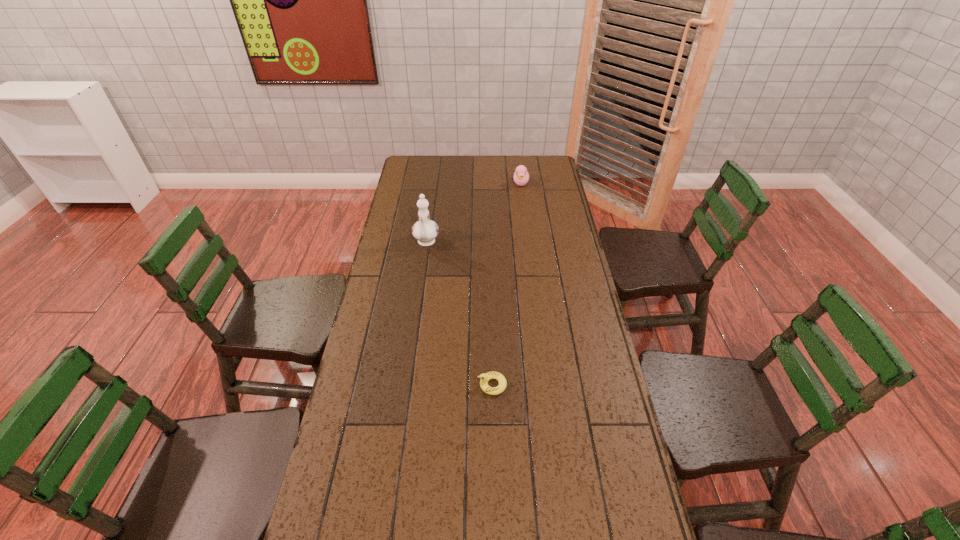
In order to click on the tallest object in this screenshot , I will do `click(425, 230)`.

Identify the location of the leftmost object. (425, 230).

You are a GUI agent. You are given a task and a screenshot of the screen. Output one action in this format:
    pyautogui.click(x=<x>, y=<y>)
    Task: Click on the second shortest object
    
    Given the screenshot: What is the action you would take?
    pyautogui.click(x=521, y=176)

Image resolution: width=960 pixels, height=540 pixels. I want to click on the farthest object, so click(521, 176).

Where is `the nearest object`? This screenshot has width=960, height=540. the nearest object is located at coordinates (486, 377).

I want to click on the shorter duckling, so click(486, 377).

The width and height of the screenshot is (960, 540). Find the location of `vacant region located 0.340m at the spout of the chinaware`. vacant region located 0.340m at the spout of the chinaware is located at coordinates (416, 319).

The height and width of the screenshot is (540, 960). Identify the location of free spot located 0.190m on the front-facing side of the farther duckling. click(x=525, y=213).

Where is `blank area located on the face of the second object from left to right`? This screenshot has height=540, width=960. blank area located on the face of the second object from left to right is located at coordinates (390, 385).

Identify the location of free location located on the face of the second object from left to right. (379, 385).